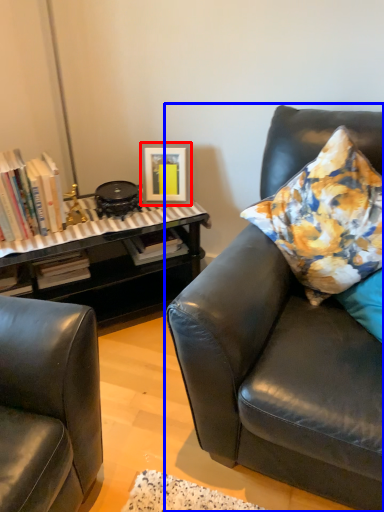
Question: Which object appears closest to the camera in this image, picture frame (highlighted by a red box) or studio couch (highlighted by a blue box)?

Choices:
 (A) picture frame
 (B) studio couch

Answer: (B)